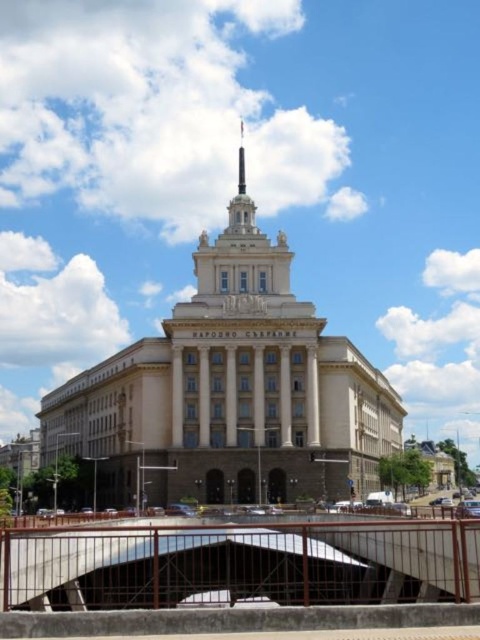
You are standing at the base of the beige stone building at center and want to take a photo with your camera. The camera has a maximum zoom range of 100 meters. Can you capture the entire building in one shot without moving the camera?

The beige stone building at center and camera are 93.88 meters apart. Since the camera can zoom up to 100 meters, you can capture the entire building in one shot without moving the camera.

You are standing at the base of the grand neoclassical building and want to cross the brown metal bridge at lower center to reach the central tower. Given that the bridge is 51.05 meters away from you, can you estimate how many steps you would need to take to reach the bridge if each step covers approximately 0.75 meters?

The brown metal bridge at lower center is 51.05 meters away. Dividing the distance by the step length of 0.75 meters gives approximately 68 steps needed to reach the bridge.

You are a tourist standing on the brown metal bridge at lower center and want to take a photo of the polished gold spire at center top. Can you see the spire clearly from your current position on the bridge?

The brown metal bridge at lower center is positioned under the polished gold spire at center top, so yes, you can see the spire clearly from your current position on the bridge.